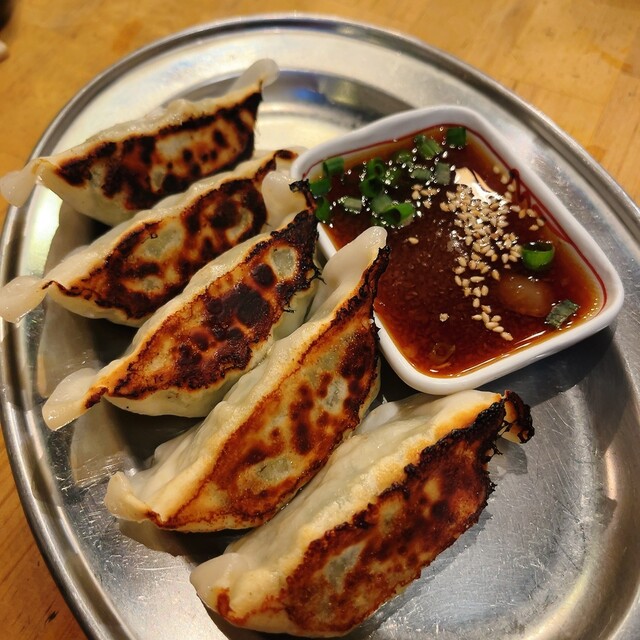
You are a GUI agent. You are given a task and a screenshot of the screen. Output one action in this format:
    pyautogui.click(x=<x>, y=<y>)
    Task: Click on the scratch marks on bottom of silver tray
    
    Given the screenshot: What is the action you would take?
    pyautogui.click(x=538, y=561), pyautogui.click(x=562, y=467), pyautogui.click(x=559, y=415), pyautogui.click(x=169, y=571), pyautogui.click(x=436, y=626)